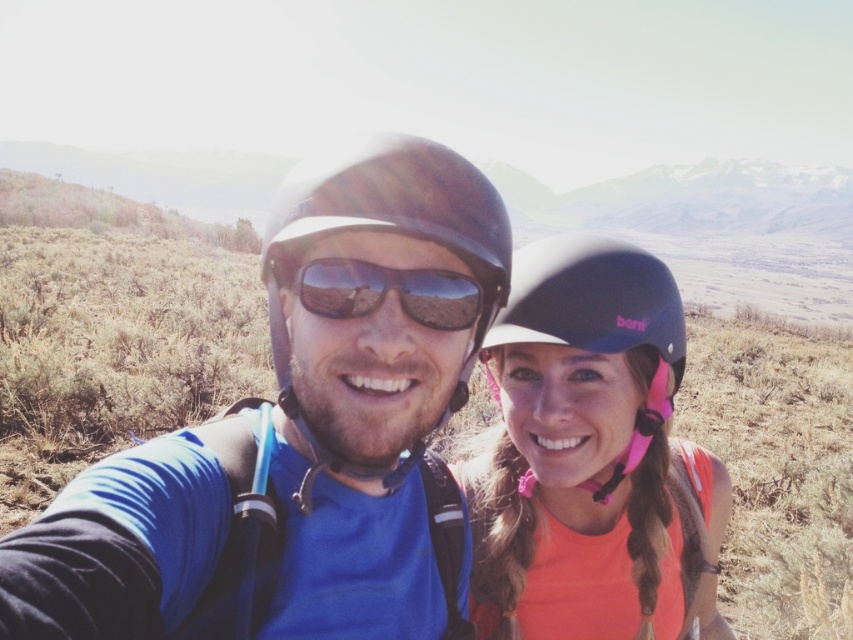
Question: Among these points, which one is farthest from the camera?

Choices:
 (A) (306, 236)
 (B) (490, 444)
 (C) (347, 500)
 (D) (618, 300)

Answer: (B)

Question: Among these objects, which one is nearest to the camera?

Choices:
 (A) matte blue helmet at right
 (B) matte black helmet at right

Answer: (B)

Question: Which of these objects is positioned farthest from the matte black sunglasses at center?

Choices:
 (A) matte black helmet at right
 (B) matte blue helmet at left
 (C) matte blue helmet at right
 (D) matte black helmet at center

Answer: (C)

Question: Is matte black helmet at right above matte black sunglasses at center?

Choices:
 (A) yes
 (B) no

Answer: (B)

Question: Is matte black helmet at center below matte black helmet at right?

Choices:
 (A) no
 (B) yes

Answer: (A)

Question: Does matte blue helmet at left have a greater width compared to matte blue helmet at right?

Choices:
 (A) yes
 (B) no

Answer: (B)